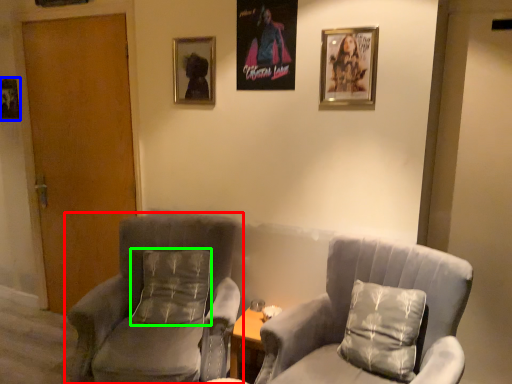
Question: Based on their relative distances, which object is nearer to chair (highlighted by a red box)? Choose from picture frame (highlighted by a blue box) and pillow (highlighted by a green box).

Choices:
 (A) picture frame
 (B) pillow

Answer: (B)